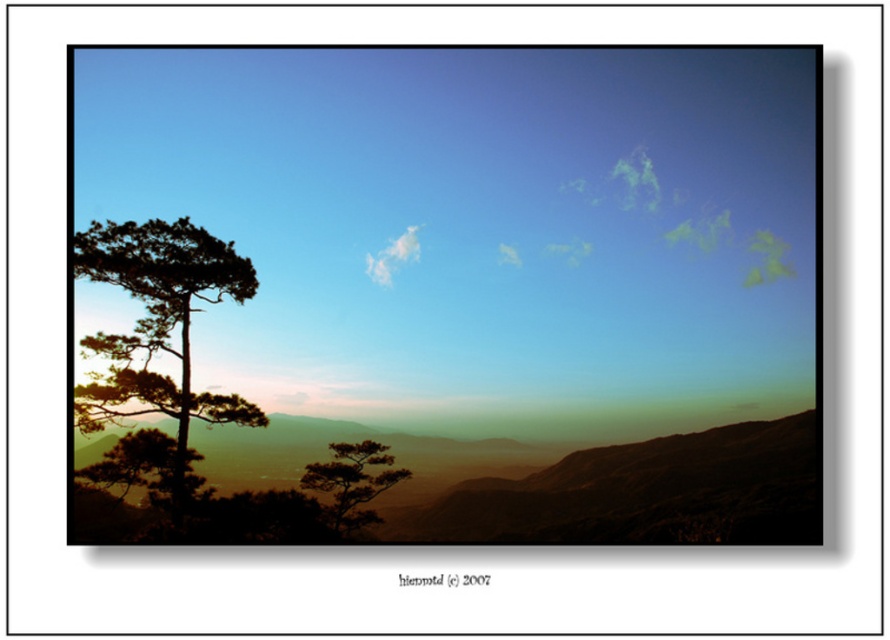
Does point (110, 355) lie in front of point (369, 449)?

That is True.

Is silhouette wood tree at left thinner than silvery metallic tree at center?

No, silhouette wood tree at left is not thinner than silvery metallic tree at center.

Is point (185, 240) farther from viewer compared to point (330, 516)?

No, (185, 240) is in front of (330, 516).

Locate an element on the screen. The height and width of the screenshot is (640, 890). silhouette wood tree at left is located at coordinates (158, 326).

Can you confirm if silhouette pine tree at left is thinner than white fluffy cloud at upper center?

Incorrect, silhouette pine tree at left's width is not less than white fluffy cloud at upper center's.

Based on the photo, does silhouette pine tree at left have a greater height compared to white fluffy cloud at upper center?

Yes, silhouette pine tree at left is taller than white fluffy cloud at upper center.

Which is in front, point (198, 460) or point (387, 246)?

Point (198, 460) is more forward.

The width and height of the screenshot is (890, 640). In order to click on silhouette pine tree at left in this screenshot , I will do `click(144, 467)`.

Is silvery metallic tree at center to the left of silhouette pine tree at left from the viewer's perspective?

Incorrect, silvery metallic tree at center is not on the left side of silhouette pine tree at left.

Is point (332, 492) more distant than point (103, 470)?

Yes.

Does point (361, 484) lie in front of point (184, 484)?

No, (361, 484) is further to viewer.

Identify the location of silvery metallic tree at center. (352, 481).